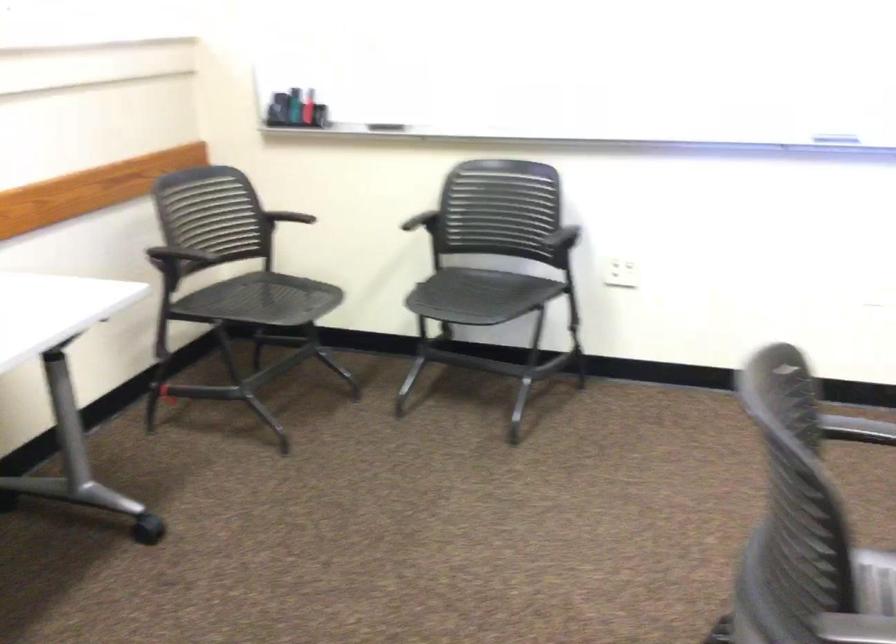
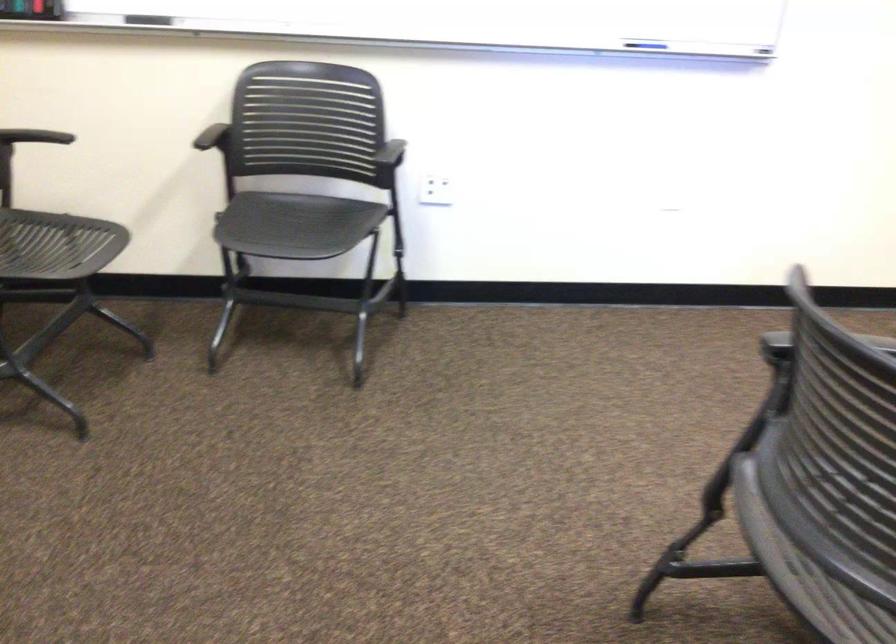
Where in the second image is the point corresponding to point (287, 301) from the first image?

(56, 245)